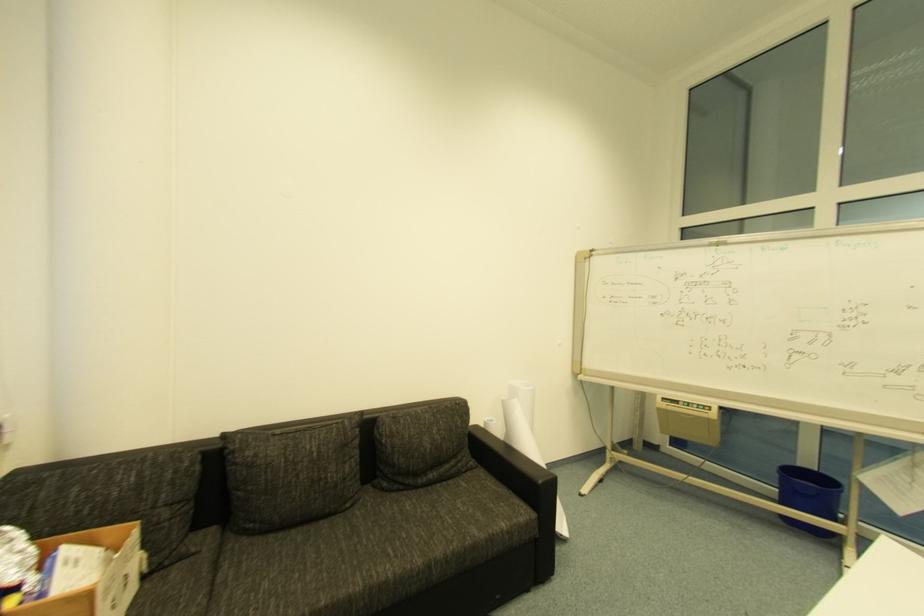
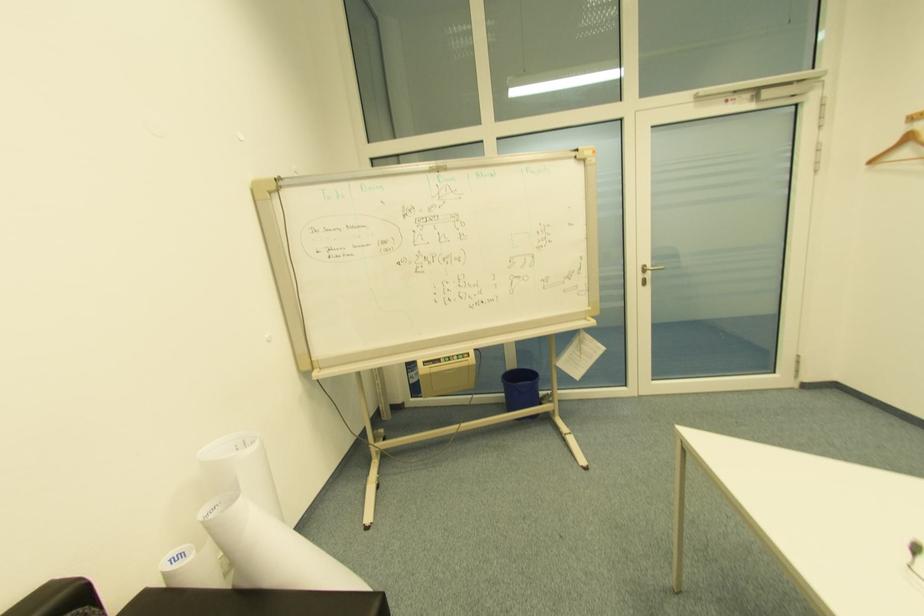
Question: The images are taken continuously from a first-person perspective. In which direction is your viewpoint rotating?

Choices:
 (A) Left
 (B) Right
 (C) Up
 (D) Down

Answer: (B)